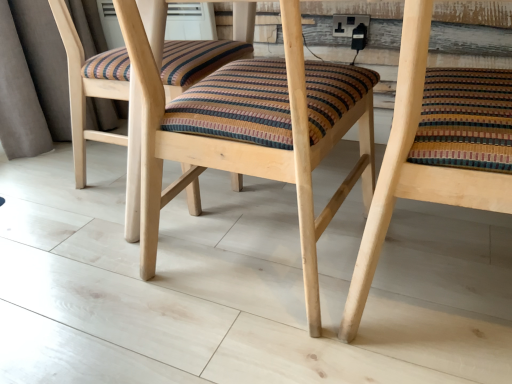
Identify the location of free spot to the left of wooden chair at center, the second chair positioned from the right. (87, 259).